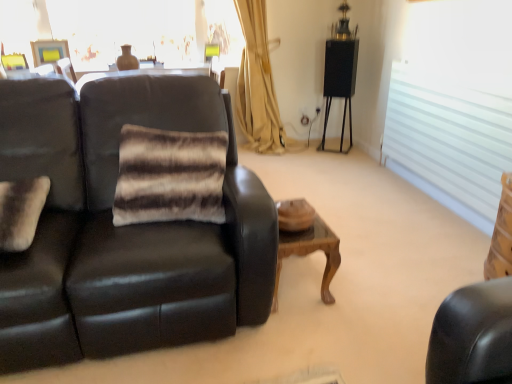
Where is `vacant location below woodenwoodentable at center (from a real-world perspective)`? The image size is (512, 384). vacant location below woodenwoodentable at center (from a real-world perspective) is located at coordinates (300, 279).